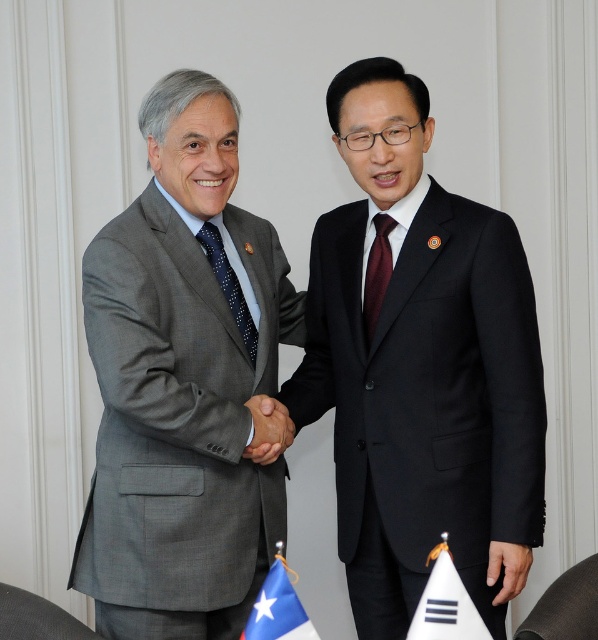
Can you confirm if gray wool suit at left is shorter than burgundy silk tie at center?

No.

Is point (178, 566) positioned after point (371, 285)?

No, (178, 566) is in front of (371, 285).

The image size is (598, 640). What are the coordinates of `gray wool suit at left` in the screenshot? It's located at (182, 381).

Is white fabric flag at lower center above blue fabric flag at lower left?

Yes, white fabric flag at lower center is above blue fabric flag at lower left.

Between white fabric flag at lower center and blue fabric flag at lower left, which one appears on the right side from the viewer's perspective?

white fabric flag at lower center

Where is `white fabric flag at lower center`? The width and height of the screenshot is (598, 640). white fabric flag at lower center is located at coordinates (446, 604).

Who is positioned more to the left, matte black suit at center or matte black hand at center?

matte black suit at center is more to the left.

Is matte black suit at center smaller than matte black hand at center?

No.

Does point (407, 278) lie behind point (492, 563)?

Yes, it is.

Identify the location of matte black suit at center. coord(419,364).